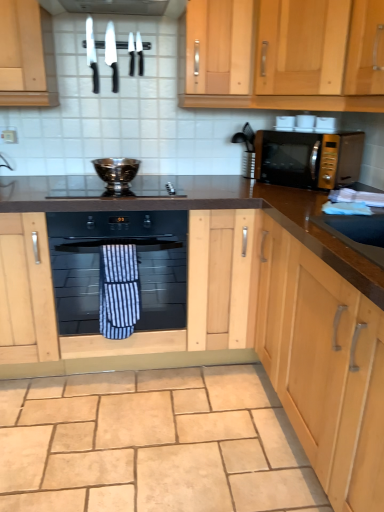
Question: Visually, is silver metallic bowl at center positioned to the left or to the right of black glass oven at center?

Choices:
 (A) right
 (B) left

Answer: (A)

Question: From the image's perspective, is silver metallic bowl at center above or below black glass oven at center?

Choices:
 (A) above
 (B) below

Answer: (A)

Question: Estimate the real-world distances between objects in this image. Which object is closer to the black plastic knife at upper center, acting as the 4th knife starting from the left?

Choices:
 (A) black matte oven at center, arranged as the 2th cabinetry when viewed from the right
 (B) shiny silver knife at upper left, which appears as the first knife when viewed from the left
 (C) silver metallic bowl at center
 (D) black plastic knife at upper center, which is the 2th knife in right-to-left order
 (E) black glass gas stove at center

Answer: (D)

Question: Considering the real-world distances, which object is closest to the shiny silver knife at upper left, the fourth knife viewed from the right?

Choices:
 (A) light wood cabinet at upper center, the second cabinetry from the bottom
 (B) black matte oven at center, which is the first cabinetry in left-to-right order
 (C) shiny silver knife at upper center, positioned as the 3th knife in right-to-left order
 (D) silver metallic bowl at center
 (E) blue striped towel at center

Answer: (C)